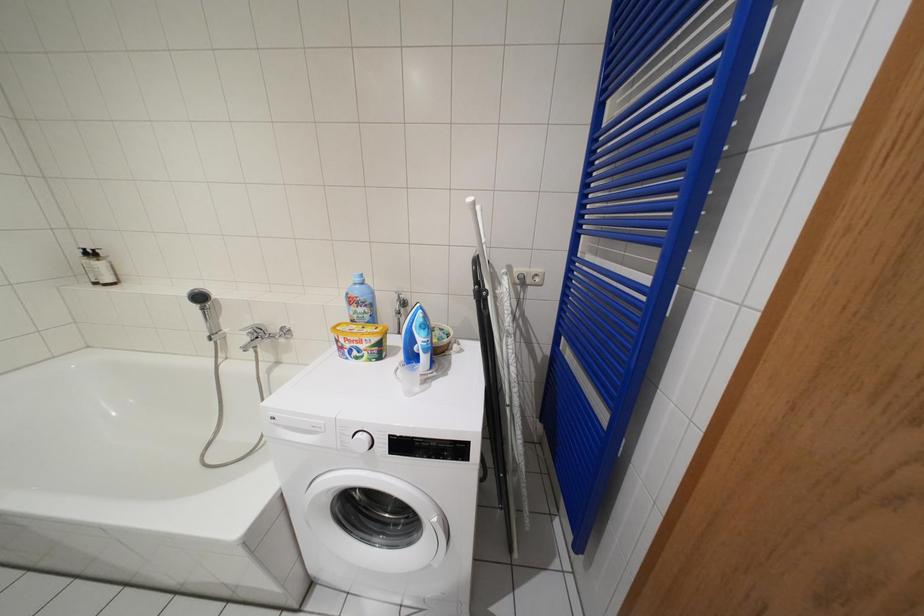
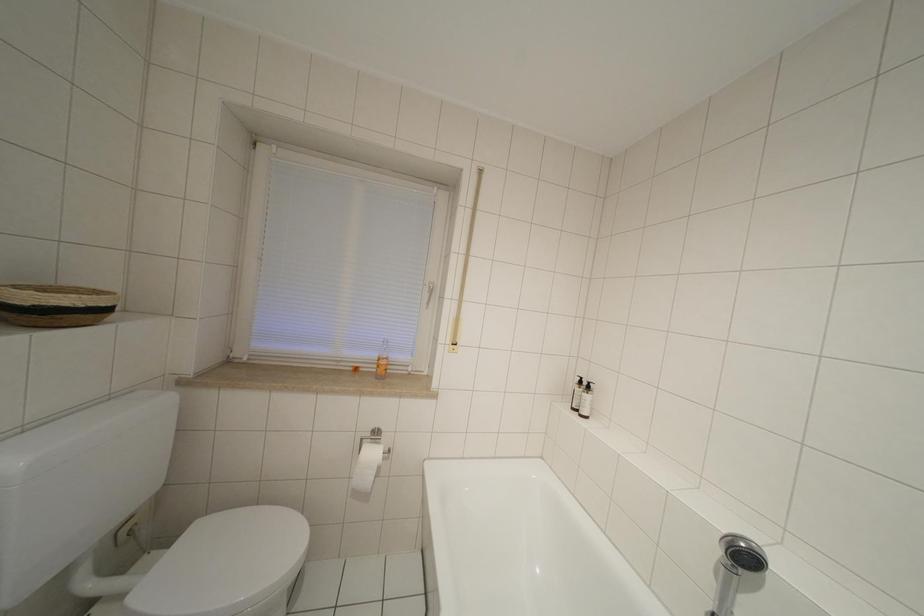
Question: Based on the continuous images, in which direction is the camera rotating? Reply with the corresponding letter.

Choices:
 (A) Left
 (B) Right
 (C) Up
 (D) Down

Answer: (A)